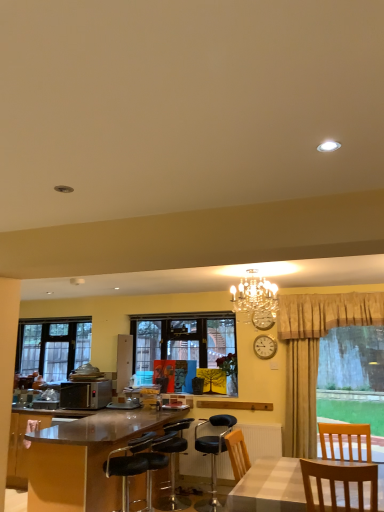
The height and width of the screenshot is (512, 384). In order to click on beige pleated curtain at right in this screenshot , I will do `click(314, 354)`.

What do you see at coordinates (86, 374) in the screenshot?
I see `metallic silver teapot at center` at bounding box center [86, 374].

Image resolution: width=384 pixels, height=512 pixels. I want to click on metallic silver teapot at center, so click(x=86, y=374).

Find the location of a particular element. wooden chair at center is located at coordinates (160, 375).

What do you see at coordinates (84, 459) in the screenshot? I see `shiny brown desk at lower left` at bounding box center [84, 459].

The image size is (384, 512). I want to click on shiny brown desk at lower left, so click(84, 459).

Find the location of a particular element. wooden chair at lower right, which is the third chair in back-to-front order is located at coordinates (348, 438).

Is glass window at center, which is counted as the second window, starting from the left, facing towards satin silver microwave at left?

No, glass window at center, which is counted as the second window, starting from the left, does not turn towards satin silver microwave at left.

Does glass window at center, arranged as the first window when viewed from the right, have a greater height compared to satin silver microwave at left?

Indeed, glass window at center, arranged as the first window when viewed from the right, has a greater height compared to satin silver microwave at left.

Between point (213, 352) and point (84, 408), which one is positioned behind?

Point (213, 352)

What's the angular difference between wooden chair at lower right, which is the third chair in back-to-front order, and black leather bar stool at center, the 3th chair when ordered from front to back,'s facing directions?

wooden chair at lower right, which is the third chair in back-to-front order, and black leather bar stool at center, the 3th chair when ordered from front to back, are facing 88.8 degrees away from each other.

Does wooden chair at lower right, marked as the third chair in a left-to-right arrangement, appear on the right side of black leather bar stool at center, the first chair from the back?

Yes, wooden chair at lower right, marked as the third chair in a left-to-right arrangement, is to the right of black leather bar stool at center, the first chair from the back.

Based on the photo, is wooden chair at lower right, positioned as the 1th chair in right-to-left order, far away from black leather bar stool at center, which is the second chair in left-to-right order?

Indeed, wooden chair at lower right, positioned as the 1th chair in right-to-left order, is not near black leather bar stool at center, which is the second chair in left-to-right order.

Who is bigger, wooden chair at lower right, the first chair viewed from the front, or black leather bar stool at center, the first chair from the back?

black leather bar stool at center, the first chair from the back.

Which object is closer to the camera, black leather bar stool at center, the first chair from the back, or beige pleated curtain at right?

beige pleated curtain at right is in front.

How different are the orientations of black leather bar stool at center, the first chair from the back, and beige pleated curtain at right in degrees?

90.8 degrees.

Is black leather bar stool at center, the 3th chair when ordered from front to back, not inside beige pleated curtain at right?

Indeed, black leather bar stool at center, the 3th chair when ordered from front to back, is completely outside beige pleated curtain at right.

From a real-world perspective, between black leather bar stool at center, the first chair from the back, and beige pleated curtain at right, who is vertically lower?

black leather bar stool at center, the first chair from the back.

From a real-world perspective, does crystal chandelier at upper center stand above shiny brown desk at lower left?

Indeed, from a real-world perspective, crystal chandelier at upper center stands above shiny brown desk at lower left.

Could you tell me if crystal chandelier at upper center is turned towards shiny brown desk at lower left?

No, crystal chandelier at upper center is not aimed at shiny brown desk at lower left.

From the image's perspective, does crystal chandelier at upper center appear higher than shiny brown desk at lower left?

Correct, crystal chandelier at upper center appears higher than shiny brown desk at lower left in the image.

Considering the sizes of objects crystal chandelier at upper center and shiny brown desk at lower left in the image provided, who is wider, crystal chandelier at upper center or shiny brown desk at lower left?

shiny brown desk at lower left is wider.

Can you confirm if black leather bar stool at lower left, the first chair positioned from the left, is positioned to the right of black leather bar stool at center, which is the second chair in left-to-right order?

No.

Between point (139, 444) and point (175, 501), which one is positioned in front?

The point (139, 444) is more forward.

From a real-world perspective, is black leather bar stool at lower left, the 2th chair when ordered from back to front, positioned above or below black leather bar stool at center, which is the second chair in left-to-right order?

In terms of real-world spatial position, black leather bar stool at lower left, the 2th chair when ordered from back to front, is above black leather bar stool at center, which is the second chair in left-to-right order.

From the image's perspective, which one is positioned higher, black leather bar stool at lower left, placed as the third chair when sorted from right to left, or black leather bar stool at center, the 3th chair when ordered from front to back?

From the image's view, black leather bar stool at lower left, placed as the third chair when sorted from right to left, is above.

From the image's perspective, is metallic silver teapot at center over black leather bar stool at center, the 3th chair when ordered from front to back?

Yes, from the image's perspective, metallic silver teapot at center is on top of black leather bar stool at center, the 3th chair when ordered from front to back.

Looking at this image, which of these two, metallic silver teapot at center or black leather bar stool at center, the 2th chair from the right, is thinner?

Thinner between the two is metallic silver teapot at center.

Considering the sizes of metallic silver teapot at center and black leather bar stool at center, the first chair from the back, in the image, is metallic silver teapot at center taller or shorter than black leather bar stool at center, the first chair from the back,?

Clearly, metallic silver teapot at center is shorter compared to black leather bar stool at center, the first chair from the back.

Does point (88, 365) lie in front of point (176, 448)?

No, (88, 365) is behind (176, 448).

From a real-world perspective, who is located lower, metallic silver teapot at center or gold metallic clock at upper center?

In real-world perspective, metallic silver teapot at center is lower.

How distant is metallic silver teapot at center from gold metallic clock at upper center?

The distance of metallic silver teapot at center from gold metallic clock at upper center is 8.00 feet.

How many degrees apart are the facing directions of metallic silver teapot at center and gold metallic clock at upper center?

The facing directions of metallic silver teapot at center and gold metallic clock at upper center are 6.37 degrees apart.

Can we say metallic silver teapot at center lies outside gold metallic clock at upper center?

Absolutely, metallic silver teapot at center is external to gold metallic clock at upper center.

Find the location of `microwave oven that is on the left side of glass window at center, which is counted as the second window, starting from the left`. microwave oven that is on the left side of glass window at center, which is counted as the second window, starting from the left is located at coordinates (86, 394).

Identify the location of chair that is on the right side of black leather bar stool at center, the first chair from the back. The height and width of the screenshot is (512, 384). (348, 438).

Which object lies nearer to the anchor point black leather bar stool at center, the 2th chair from the right, black leather bar stool at lower left, placed as the third chair when sorted from right to left, or satin silver microwave at left?

Among the two, black leather bar stool at lower left, placed as the third chair when sorted from right to left, is located nearer to black leather bar stool at center, the 2th chair from the right.

Which object lies nearer to the anchor point metallic silver teapot at center, glass window at center, which is counted as the second window, starting from the left, or yellow matte picture frame at center?

glass window at center, which is counted as the second window, starting from the left, is closer to metallic silver teapot at center.

Estimate the real-world distances between objects in this image. Which object is closer to wooden chair at center, yellow matte picture frame at center or metallic silver teapot at center?

yellow matte picture frame at center is closer to wooden chair at center.

Based on their spatial positions, is beige pleated curtain at right or metallic silver teapot at center further from wooden chair at center?

beige pleated curtain at right.

Looking at the image, which one is located further to clear glass window at left, the 1th window when ordered from left to right, gold metallic clock at upper center or crystal chandelier at upper center?

crystal chandelier at upper center is further to clear glass window at left, the 1th window when ordered from left to right.

Based on the photo, from the image, which object appears to be farther from crystal chandelier at upper center, wooden chair at lower right, positioned as the 1th chair in right-to-left order, or metallic silver teapot at center?

Among the two, metallic silver teapot at center is located further to crystal chandelier at upper center.

From the picture: From the image, which object appears to be nearer to shiny brown desk at lower left, black leather bar stool at center, the 3th chair when ordered from front to back, or gold metallic clock at upper center?

black leather bar stool at center, the 3th chair when ordered from front to back.

When comparing their distances from yellow matte picture frame at center, does wooden chair at lower right, positioned as the 1th chair in right-to-left order, or clear glass window at left, which is counted as the second window, starting from the right, seem further?

clear glass window at left, which is counted as the second window, starting from the right, is further to yellow matte picture frame at center.

In order to click on lamp positioned between black leather bar stool at lower left, the 2th chair when ordered from back to front, and yellow matte picture frame at center from near to far in this screenshot , I will do `click(256, 298)`.

This screenshot has width=384, height=512. What are the coordinates of `clock located between wooden chair at lower right, the first chair viewed from the front, and wooden chair at center in the depth direction` in the screenshot? It's located at (263, 319).

Image resolution: width=384 pixels, height=512 pixels. What are the coordinates of `clock between satin silver microwave at left and beige pleated curtain at right from left to right` in the screenshot? It's located at (263, 319).

Find the location of a particular element. microwave oven located between wooden chair at lower right, positioned as the 1th chair in right-to-left order, and metallic silver teapot at center in the depth direction is located at coordinates (86, 394).